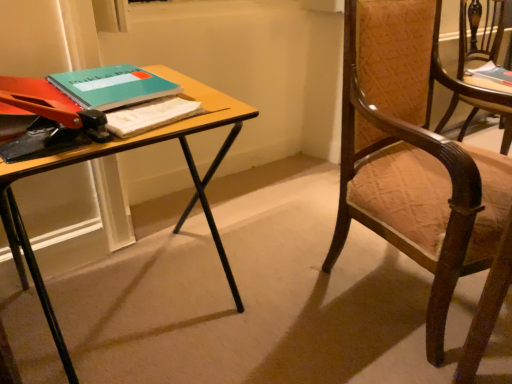
Where is `vacant space underneath wooden chair with upholstered seat at right, acting as the first chair starting from the left (from a real-world perspective)`? vacant space underneath wooden chair with upholstered seat at right, acting as the first chair starting from the left (from a real-world perspective) is located at coordinates (395, 284).